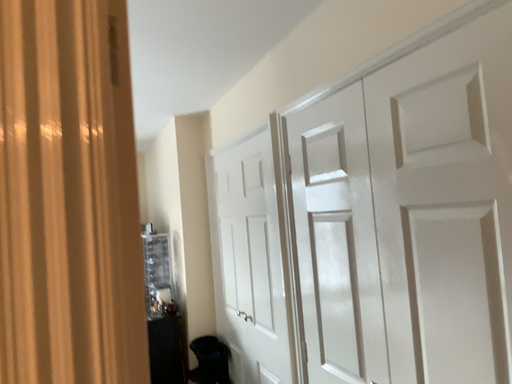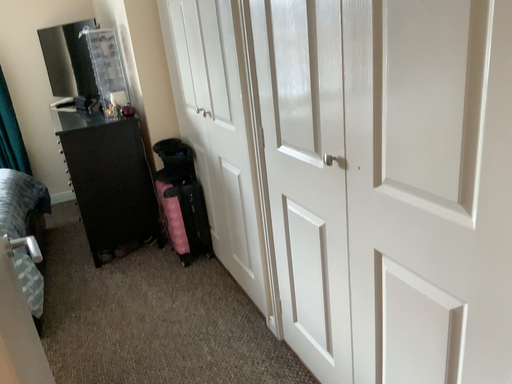
Question: Which way did the camera rotate in the video?

Choices:
 (A) rotated upward
 (B) rotated downward

Answer: (B)